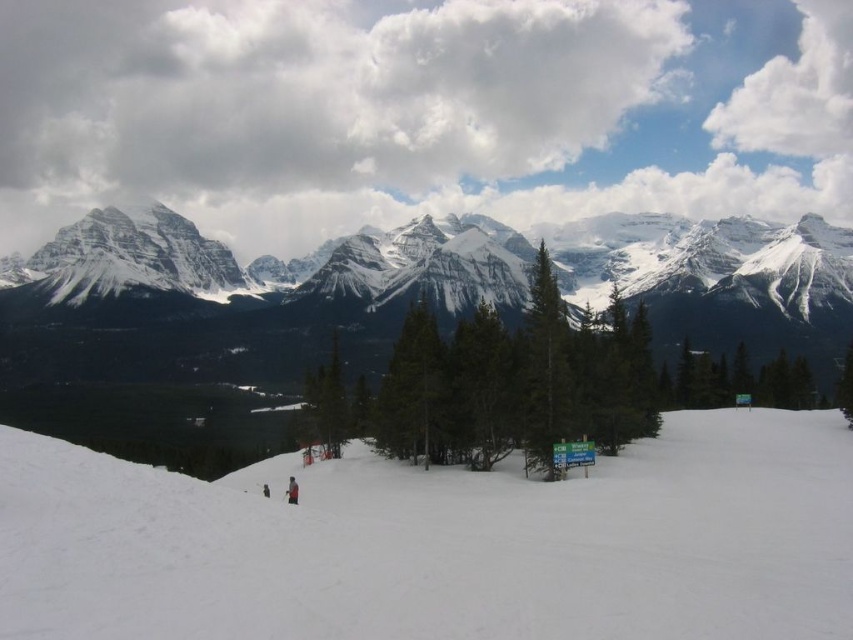
Question: Can you confirm if white snow at center is positioned above snowy granite mountain range at upper center?

Choices:
 (A) yes
 (B) no

Answer: (B)

Question: Which point is farther to the camera?

Choices:
 (A) green matte tree at center
 (B) snowy granite mountain range at upper center

Answer: (B)

Question: Which of the following is the closest to the observer?

Choices:
 (A) coord(636,269)
 (B) coord(428,355)

Answer: (B)

Question: Does white snow at center have a smaller size compared to green matte tree at center?

Choices:
 (A) no
 (B) yes

Answer: (A)

Question: Is green textured pine at center closer to the viewer compared to green matte tree at center?

Choices:
 (A) yes
 (B) no

Answer: (A)

Question: Based on their relative distances, which object is nearer to the green matte tree at center?

Choices:
 (A) green textured pine at center
 (B) white snow at center
 (C) snowy granite mountain range at upper center

Answer: (A)